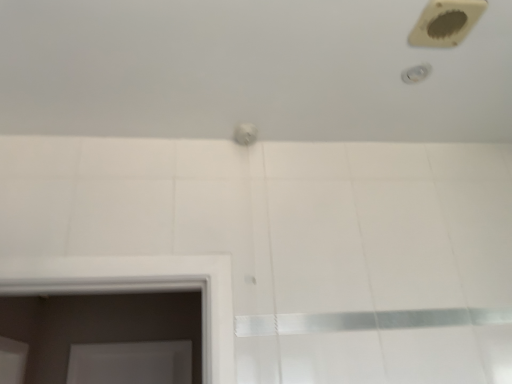
Image resolution: width=512 pixels, height=384 pixels. Identify the location of white glossy shower at upper right. (416, 73).

This screenshot has height=384, width=512. What do you see at coordinates (446, 22) in the screenshot? I see `beige plastic hole at upper right` at bounding box center [446, 22].

Describe the element at coordinates (249, 71) in the screenshot. I see `white glossy bath at upper center` at that location.

You are a GUI agent. You are given a task and a screenshot of the screen. Output one action in this format:
    pyautogui.click(x=<x>, y=<y>)
    Task: Click on the white glossy shower at upper right
    
    Given the screenshot: What is the action you would take?
    pyautogui.click(x=416, y=73)

In the scene shown: Measure the distance between white glossy bath at upper center and beige plastic hole at upper right.

white glossy bath at upper center is 17.33 inches away from beige plastic hole at upper right.

Considering the relative sizes of white glossy bath at upper center and beige plastic hole at upper right in the image provided, is white glossy bath at upper center wider than beige plastic hole at upper right?

Indeed, white glossy bath at upper center has a greater width compared to beige plastic hole at upper right.

Where is `bath in front of the beige plastic hole at upper right`? bath in front of the beige plastic hole at upper right is located at coordinates (249, 71).

From the image's perspective, is white glossy bath at upper center above or below beige plastic hole at upper right?

white glossy bath at upper center is situated lower than beige plastic hole at upper right in the image.

From the image's perspective, which one is positioned lower, white glossy shower at upper right or white glossy bath at upper center?

white glossy bath at upper center appears lower in the image.

From the picture: Between white glossy shower at upper right and white glossy bath at upper center, which one has larger width?

Wider between the two is white glossy bath at upper center.

Is white glossy shower at upper right shorter than white glossy bath at upper center?

Yes, white glossy shower at upper right is shorter than white glossy bath at upper center.

From a real-world perspective, is white glossy shower at upper right positioned above or below white glossy bath at upper center?

white glossy shower at upper right is situated lower than white glossy bath at upper center in the real world.

Where is `hole that appears above the white glossy bath at upper center (from the image's perspective)`? hole that appears above the white glossy bath at upper center (from the image's perspective) is located at coordinates (446, 22).

Considering the relative sizes of beige plastic hole at upper right and white glossy bath at upper center in the image provided, is beige plastic hole at upper right shorter than white glossy bath at upper center?

Yes.

From a real-world perspective, which object rests below the other?

In real-world perspective, beige plastic hole at upper right is lower.

Is beige plastic hole at upper right located outside white glossy bath at upper center?

No, beige plastic hole at upper right is inside or overlapping with white glossy bath at upper center.

Does white glossy bath at upper center have a lesser height compared to white glossy shower at upper right?

Incorrect, the height of white glossy bath at upper center does not fall short of that of white glossy shower at upper right.

Are white glossy bath at upper center and white glossy shower at upper right far apart?

No, white glossy bath at upper center is not far away from white glossy shower at upper right.

Is white glossy bath at upper center oriented towards white glossy shower at upper right?

Yes, white glossy bath at upper center is oriented towards white glossy shower at upper right.

From the image's perspective, who appears lower, white glossy bath at upper center or white glossy shower at upper right?

white glossy bath at upper center, from the image's perspective.

Would you say beige plastic hole at upper right is outside white glossy shower at upper right?

beige plastic hole at upper right is positioned outside white glossy shower at upper right.

Identify the location of shower below the beige plastic hole at upper right (from the image's perspective). (416, 73).

Which of these two, beige plastic hole at upper right or white glossy shower at upper right, is bigger?

With larger size is beige plastic hole at upper right.

Where is `shower positioned vertically above the beige plastic hole at upper right (from a real-world perspective)`? shower positioned vertically above the beige plastic hole at upper right (from a real-world perspective) is located at coordinates (416, 73).

Is white glossy shower at upper right further to camera compared to beige plastic hole at upper right?

Yes, it is.

From a real-world perspective, does white glossy shower at upper right stand above beige plastic hole at upper right?

Yes, from a real-world perspective, white glossy shower at upper right is above beige plastic hole at upper right.

Does white glossy shower at upper right turn towards beige plastic hole at upper right?

No, white glossy shower at upper right is not turned towards beige plastic hole at upper right.

What are the coordinates of `hole lying above the white glossy bath at upper center (from the image's perspective)` in the screenshot? It's located at (446, 22).

Locate an element on the screen. This screenshot has height=384, width=512. shower behind the white glossy bath at upper center is located at coordinates (416, 73).

When comparing their distances from white glossy shower at upper right, does beige plastic hole at upper right or white glossy bath at upper center seem closer?

Among the two, beige plastic hole at upper right is located nearer to white glossy shower at upper right.

Based on their spatial positions, is white glossy shower at upper right or beige plastic hole at upper right further from white glossy bath at upper center?

white glossy shower at upper right lies further to white glossy bath at upper center than the other object.

Based on their spatial positions, is white glossy shower at upper right or white glossy bath at upper center closer to beige plastic hole at upper right?

white glossy shower at upper right.

When comparing their distances from white glossy shower at upper right, does white glossy bath at upper center or beige plastic hole at upper right seem closer?

The object closer to white glossy shower at upper right is beige plastic hole at upper right.

Looking at the image, which one is located further to beige plastic hole at upper right, white glossy bath at upper center or white glossy shower at upper right?

The object further to beige plastic hole at upper right is white glossy bath at upper center.

Looking at the image, which one is located further to white glossy bath at upper center, beige plastic hole at upper right or white glossy shower at upper right?

white glossy shower at upper right is positioned further to the anchor white glossy bath at upper center.

This screenshot has height=384, width=512. Find the location of `shower located between white glossy bath at upper center and beige plastic hole at upper right in the left-right direction`. shower located between white glossy bath at upper center and beige plastic hole at upper right in the left-right direction is located at coordinates (416, 73).